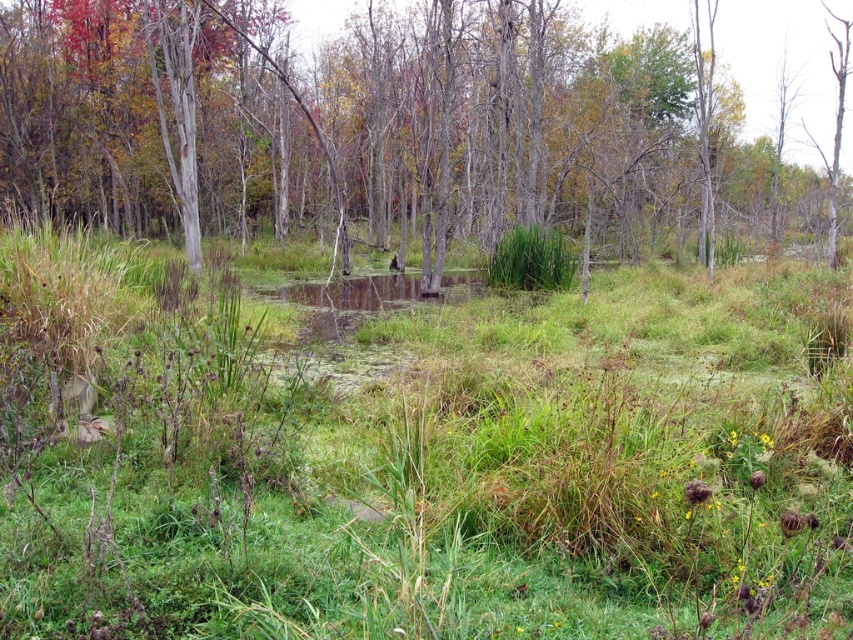
You are a gardener trying to maintain the wetland area. You notice two types of green grassy at center and green grass at center. Which one has a narrower width?

The green grassy at center is thinner than the green grass at center, so the green grassy at center has a narrower width.

In the scene shown: You are standing at the origin point in the scene. Where is the green grassy at center located in terms of its 2D coordinates?

The green grassy at center is located at the 2D coordinates of point (421,464).